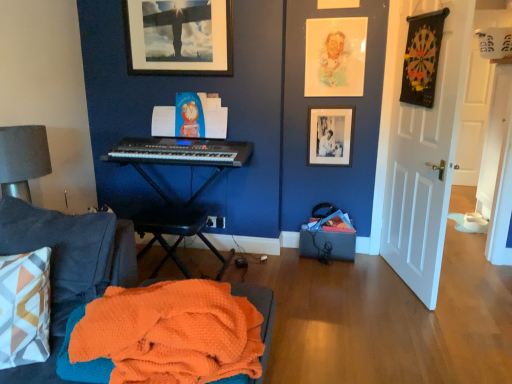
Locate an element on the screen. vacant area that lies between white matte door at right and black plastic music stool at center is located at coordinates (328, 286).